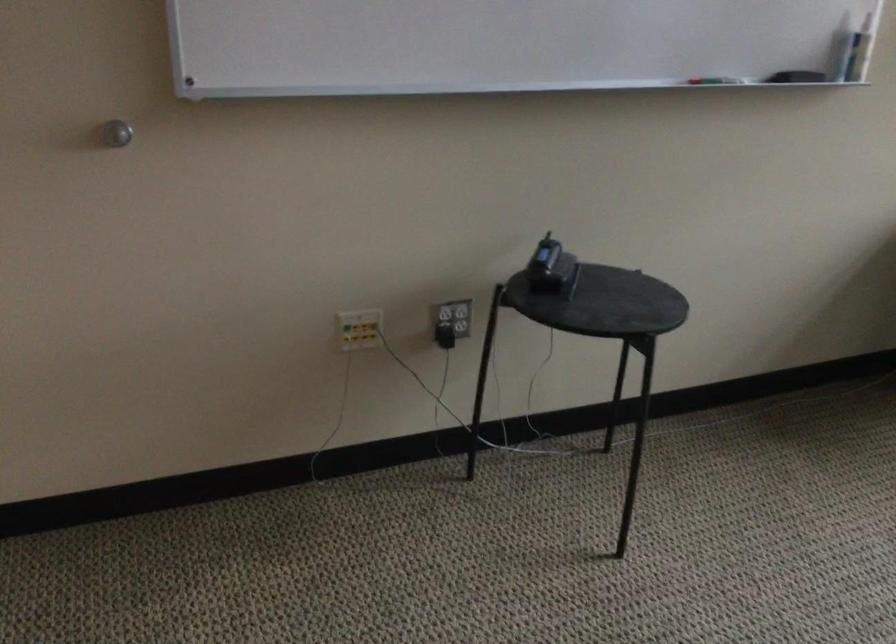
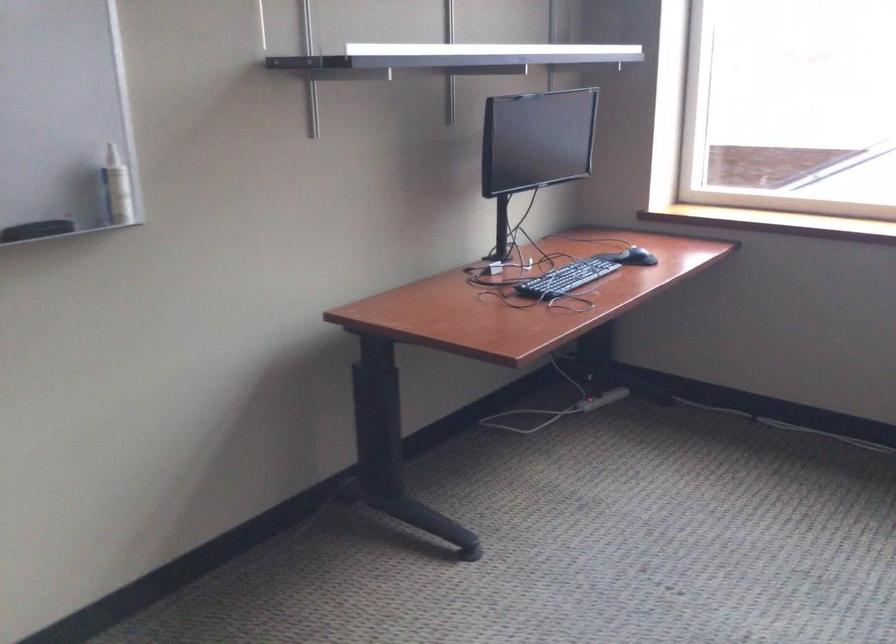
Question: How did the camera likely rotate?

Choices:
 (A) Left
 (B) Right
 (C) Up
 (D) Down

Answer: (B)